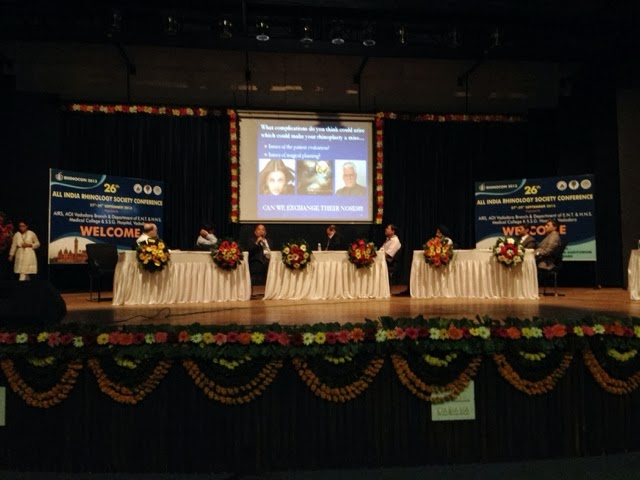
Locate an element on the screen. floor is located at coordinates (596, 470).